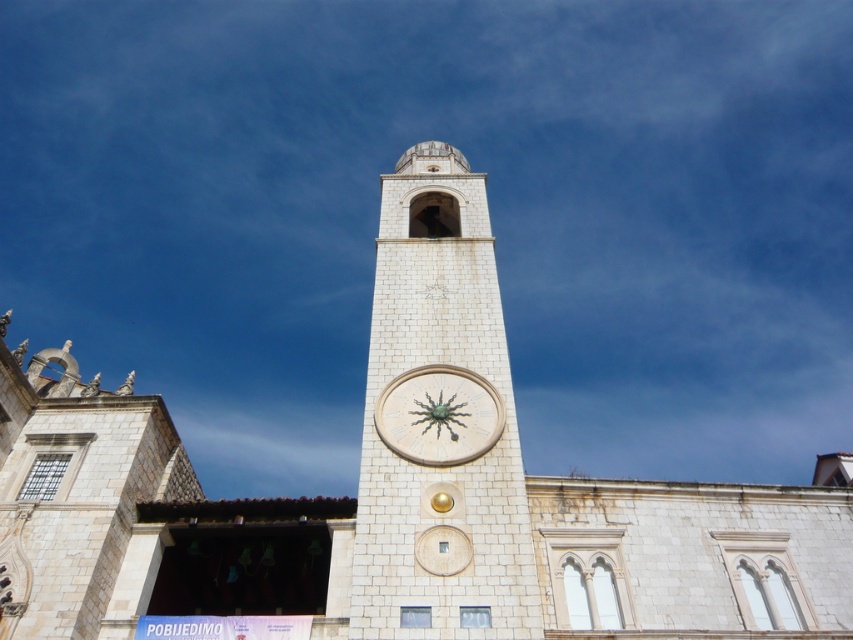
Question: Is white stone clock tower at center above white stone clock at center?

Choices:
 (A) no
 (B) yes

Answer: (B)

Question: Among these points, which one is nearest to the camera?

Choices:
 (A) (384, 406)
 (B) (375, 442)

Answer: (B)

Question: Does white stone clock tower at center come behind white stone clock at center?

Choices:
 (A) yes
 (B) no

Answer: (B)

Question: Is white stone clock tower at center bigger than white stone clock at center?

Choices:
 (A) yes
 (B) no

Answer: (A)